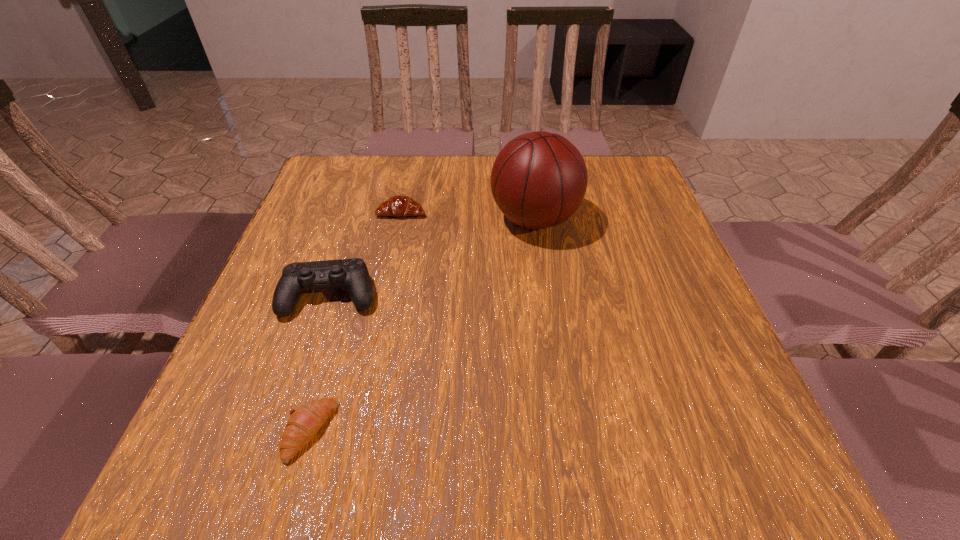
Locate an element on the screen. basketball is located at coordinates (538, 180).

Find the location of a particular element. The width and height of the screenshot is (960, 540). the rightmost object is located at coordinates pos(538,180).

Locate an element on the screen. Image resolution: width=960 pixels, height=540 pixels. the second nearest object is located at coordinates (353, 274).

Locate an element on the screen. Image resolution: width=960 pixels, height=540 pixels. control is located at coordinates (353, 274).

Locate an element on the screen. The width and height of the screenshot is (960, 540). the taller crescent roll is located at coordinates (399, 206).

At what (x,y) coordinates should I click in order to perform the action: click on the farther crescent roll. Please return your answer as a coordinate pair (x, y). The width and height of the screenshot is (960, 540). Looking at the image, I should click on (399, 206).

The image size is (960, 540). Find the location of `the nearest object`. the nearest object is located at coordinates (305, 422).

At what (x,y) coordinates should I click in order to perform the action: click on the shortest object. Please return your answer as a coordinate pair (x, y). This screenshot has width=960, height=540. Looking at the image, I should click on (305, 422).

Identify the location of vacant space situated on the left of the basketball. This screenshot has width=960, height=540. (458, 219).

This screenshot has width=960, height=540. I want to click on free region located on the front of the second nearest object, so click(300, 389).